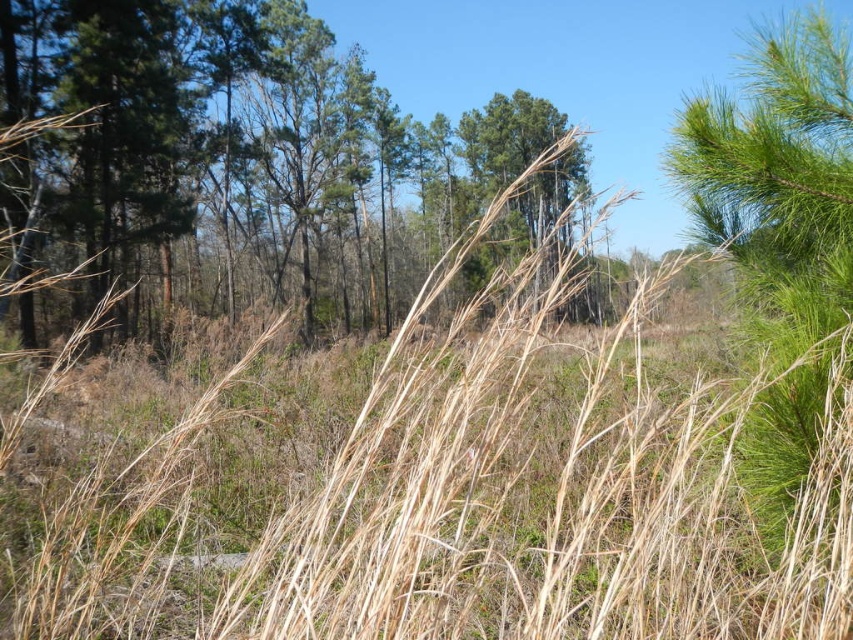
Which of these two, green leafy tree at center or green needle-like at right, stands taller?

Standing taller between the two is green leafy tree at center.

Is green leafy tree at center positioned in front of green needle-like at right?

That is False.

This screenshot has width=853, height=640. Identify the location of green leafy tree at center. click(239, 154).